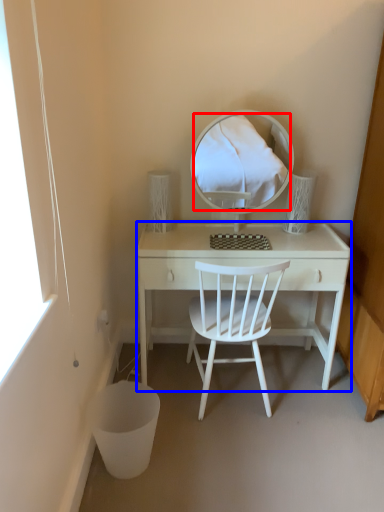
Question: Which object is further to the camera taking this photo, mirror (highlighted by a red box) or desk (highlighted by a blue box)?

Choices:
 (A) mirror
 (B) desk

Answer: (B)